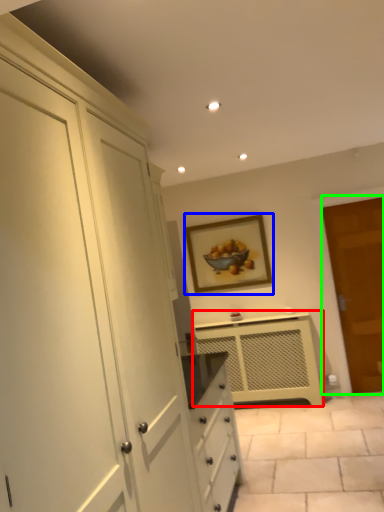
Question: Which object is the closest to the cabinetry (highlighted by a red box)? Choose among these: picture frame (highlighted by a blue box) or door (highlighted by a green box).

Choices:
 (A) picture frame
 (B) door

Answer: (A)